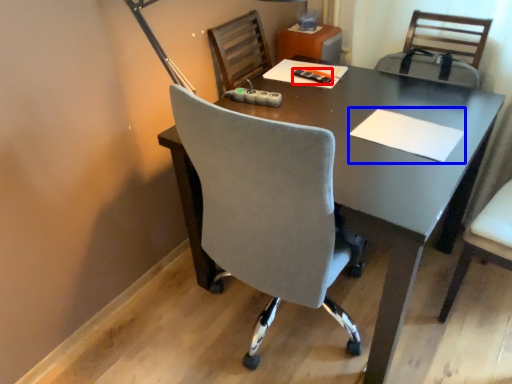
Question: Which point is closer to the camera, stationery (highlighted by a red box) or notepad (highlighted by a blue box)?

Choices:
 (A) stationery
 (B) notepad

Answer: (B)